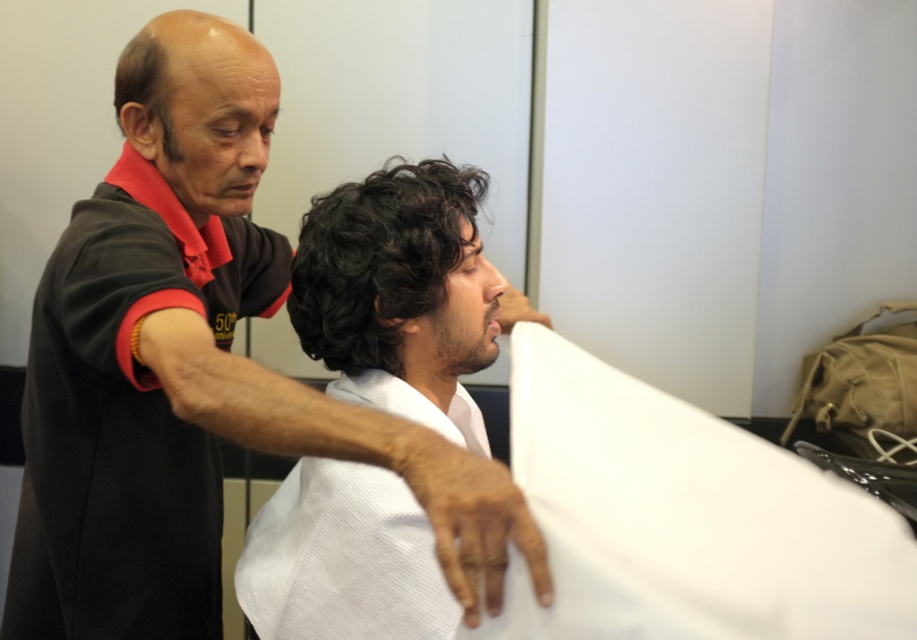
You are a customer in a barbershop and want to know if the distance between the white cotton robe at upper center and the black curly hair at center is less than 12 inches. Can you confirm?

The white cotton robe at upper center is 10.57 inches away from the black curly hair at center, so yes, the distance is less than 12 inches.